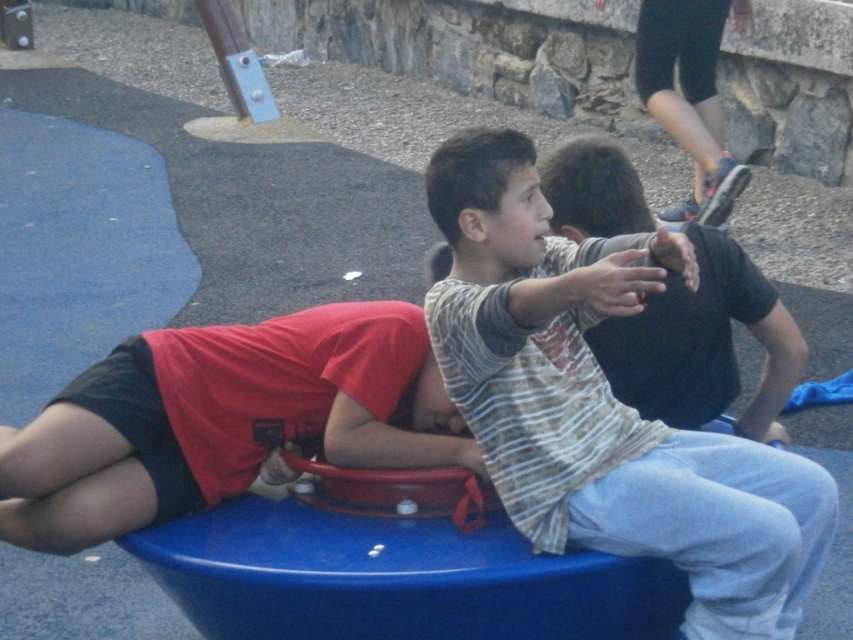
You are a photographer trying to capture a photo of both the striped cotton shirt at center and the matte red shirt at lower left. Based on their positions, which shirt should you focus on first to ensure both are in frame?

The striped cotton shirt at center is above the matte red shirt at lower left, so you should focus on the matte red shirt at lower left first to ensure both are in frame.

You are standing at the entrance of the playground and want to find the striped cotton shirt at center. Based on the coordinates provided, in which direction should you look relative to your starting position?

The striped cotton shirt at center is located at coordinates point [602,403]. Since the coordinate system typically places the origin at the bottom left corner, 0.631 on the x axis means it is to the right, and 0.708 on the y axis means it is upwards from the bottom. Therefore, you should look to the upper right direction from your starting position at the entrance.